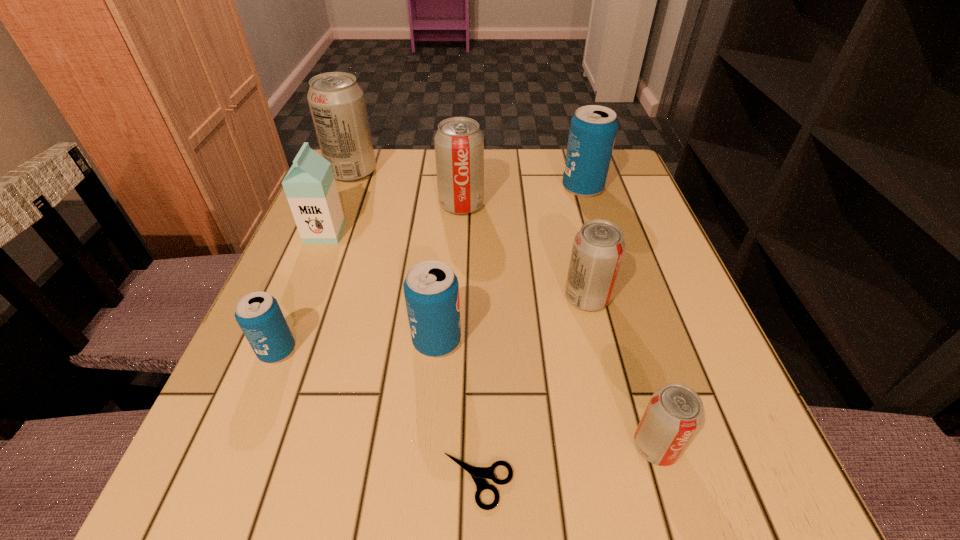
Point out which blue soda can is positioned as the nearest to the smallest blue soda can. Please provide its 2D coordinates. Your answer should be formatted as a tuple, i.e. [(x, y)], where the tuple contains the x and y coordinates of a point satisfying the conditions above.

[(431, 289)]

Where is `vacant space that satisfies the following two spatial constraints: 1. on the back side of the rightmost blue soda can; 2. on the left side of the third biggest gray soda can`? The width and height of the screenshot is (960, 540). vacant space that satisfies the following two spatial constraints: 1. on the back side of the rightmost blue soda can; 2. on the left side of the third biggest gray soda can is located at coordinates (561, 188).

Locate an element on the screen. This screenshot has height=540, width=960. free region that satisfies the following two spatial constraints: 1. on the front side of the leftmost gray soda can; 2. on the right side of the second blue soda can from right to left is located at coordinates (286, 341).